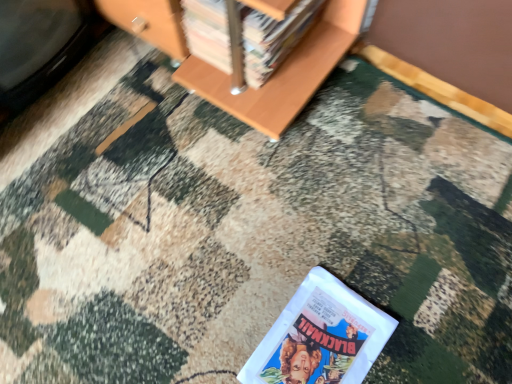
The width and height of the screenshot is (512, 384). Find the location of `vacant space situated above white glossy book at lower center, the 2th book in the top-to-bottom sequence (from a real-world perspective)`. vacant space situated above white glossy book at lower center, the 2th book in the top-to-bottom sequence (from a real-world perspective) is located at coordinates (322, 339).